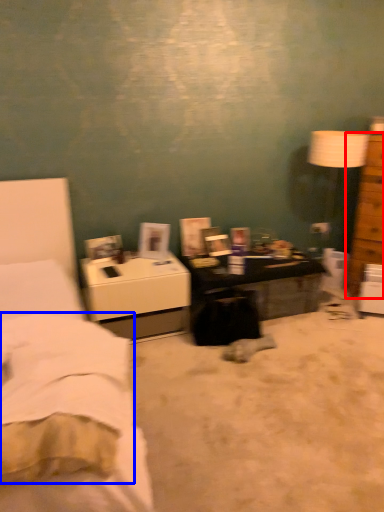
Question: Which object is closer to the camera taking this photo, chest of drawers (highlighted by a red box) or sheet (highlighted by a blue box)?

Choices:
 (A) chest of drawers
 (B) sheet

Answer: (B)